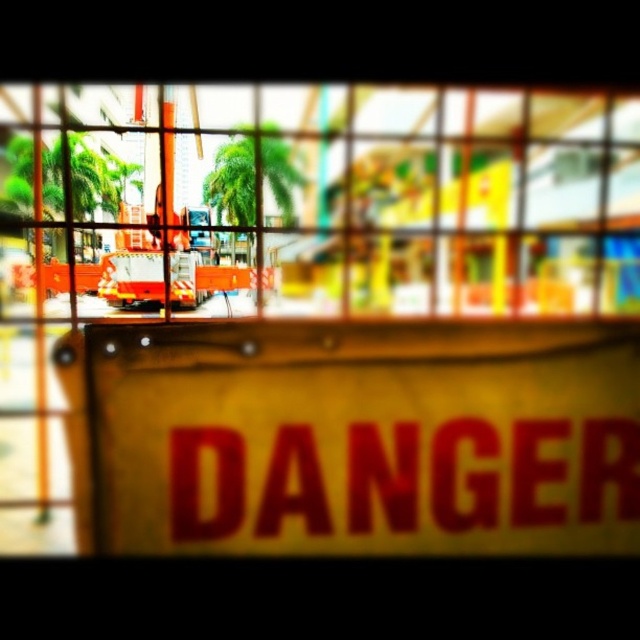
You are a maintenance worker standing 1.6 meters tall. You need to reach the yellow matte sign at center to check its visibility. Can you reach the sign without any tools?

The distance between you and the yellow matte sign at center is 1.70 meters. Since you are 1.6 meters tall, you cannot reach the sign without tools as the distance exceeds your height.